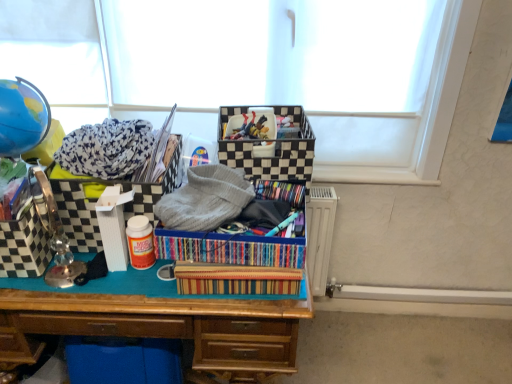
Question: Are wooden desk at center and gray knitted sweater at center far apart?

Choices:
 (A) yes
 (B) no

Answer: (B)

Question: From the image's perspective, is wooden desk at center beneath gray knitted sweater at center?

Choices:
 (A) yes
 (B) no

Answer: (A)

Question: Is wooden desk at center outside of gray knitted sweater at center?

Choices:
 (A) yes
 (B) no

Answer: (A)

Question: Is wooden desk at center further to the viewer compared to gray knitted sweater at center?

Choices:
 (A) no
 (B) yes

Answer: (B)

Question: Can you confirm if wooden desk at center is positioned to the left of gray knitted sweater at center?

Choices:
 (A) no
 (B) yes

Answer: (B)

Question: Is wooden desk at center bigger than gray knitted sweater at center?

Choices:
 (A) no
 (B) yes

Answer: (B)

Question: Is checkerboard-patterned storage box at left, which is the 1th storage box in left-to-right order, not near multicolored striped fabric at center?

Choices:
 (A) no
 (B) yes

Answer: (A)

Question: Is checkerboard-patterned storage box at left, which is the 1th storage box in left-to-right order, positioned behind multicolored striped fabric at center?

Choices:
 (A) yes
 (B) no

Answer: (A)

Question: Is checkerboard-patterned storage box at left, which is the 1th storage box in left-to-right order, facing towards multicolored striped fabric at center?

Choices:
 (A) no
 (B) yes

Answer: (A)

Question: From the image's perspective, would you say checkerboard-patterned storage box at left, which is the 1th storage box in left-to-right order, is shown under multicolored striped fabric at center?

Choices:
 (A) no
 (B) yes

Answer: (B)

Question: Is checkerboard-patterned storage box at left, acting as the third storage box starting from the right, smaller than multicolored striped fabric at center?

Choices:
 (A) yes
 (B) no

Answer: (A)

Question: Is checkerboard-patterned storage box at left, acting as the third storage box starting from the right, turned away from multicolored striped fabric at center?

Choices:
 (A) no
 (B) yes

Answer: (A)

Question: From the image's perspective, is wooden desk at center located above checkered fabric storage box at left, the 2th storage box positioned from the left?

Choices:
 (A) no
 (B) yes

Answer: (A)